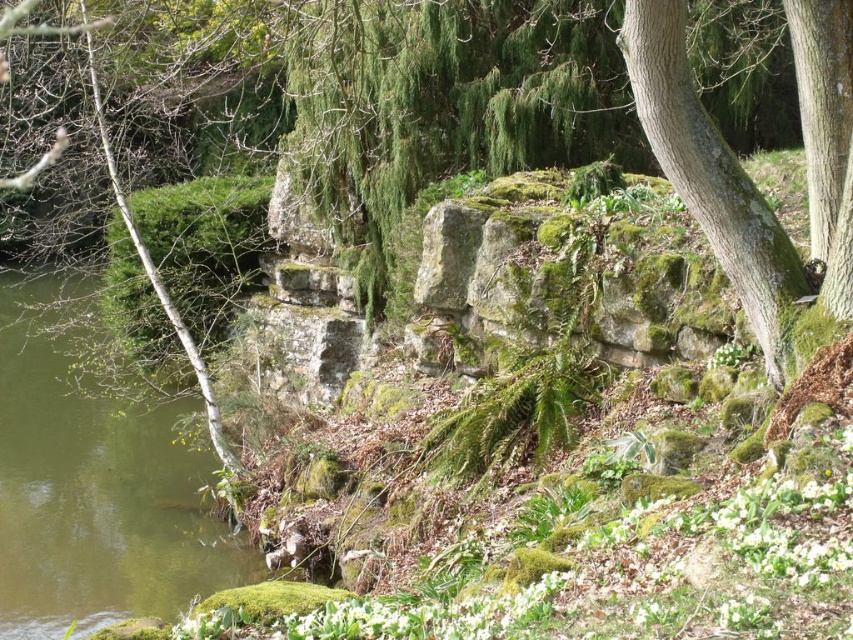
You are a hiker who wants to cross the green liquid water at left to reach the green rough bark tree at right. Based on the scene description, can you safely walk across the water to get to the tree?

The green liquid water at left is taller than the green rough bark tree at right, which means the water is deeper than the tree height. Since the water is deeper than the tree, it might be too deep to walk across safely. Therefore, it is not advisable to attempt crossing the water to reach the tree.

You are standing in front of the mossy stone wall and want to pour a small amount of red dye into either the green liquid water at left or the green rough bark tree at right. Which object would allow the dye to spread more widely?

The green liquid water at left is larger in size than the green rough bark tree at right, so pouring the dye into the green liquid water at left would allow the dye to spread more widely.